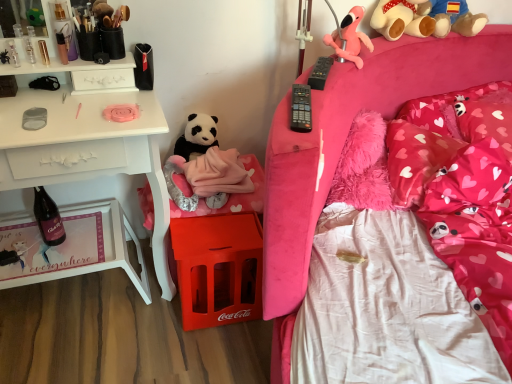
Question: From a real-world perspective, is clear plastic bottles at upper left, the first toiletry positioned from the left, above or below brown plush teddy bear at upper right?

Choices:
 (A) above
 (B) below

Answer: (B)

Question: From the image's perspective, relative to brown plush teddy bear at upper right, is clear plastic bottles at upper left, the first toiletry positioned from the left, above or below?

Choices:
 (A) above
 (B) below

Answer: (B)

Question: Considering the real-world distances, which object is closest to the metallic gold lip balm at upper left, positioned as the second toiletry in left-to-right order?

Choices:
 (A) pink fluffy pillow at upper right, placed as the 1th pillow when sorted from right to left
 (B) clear plastic bottles at upper left, the first toiletry positioned from the left
 (C) pink fluffy pillow at upper right, marked as the 1th pillow in a left-to-right arrangement
 (D) pink plush teddy bear at upper right, which is the third teddy bear in left-to-right order
 (E) pink plush toy at upper right, the 2th teddy bear from the top

Answer: (B)

Question: Estimate the real-world distances between objects in this image. Which object is farther from the pink plush teddy bear at upper right, the 1th teddy bear when ordered from right to left?

Choices:
 (A) black plastic remote control at upper right, placed as the second remote control when sorted from left to right
 (B) pink fluffy pillow at upper right, marked as the 1th pillow in a left-to-right arrangement
 (C) black plastic remote control at upper right, acting as the 2th remote control starting from the right
 (D) brown plush teddy bear at upper right
 (E) pink plush toy at upper right, acting as the second teddy bear starting from the bottom

Answer: (C)